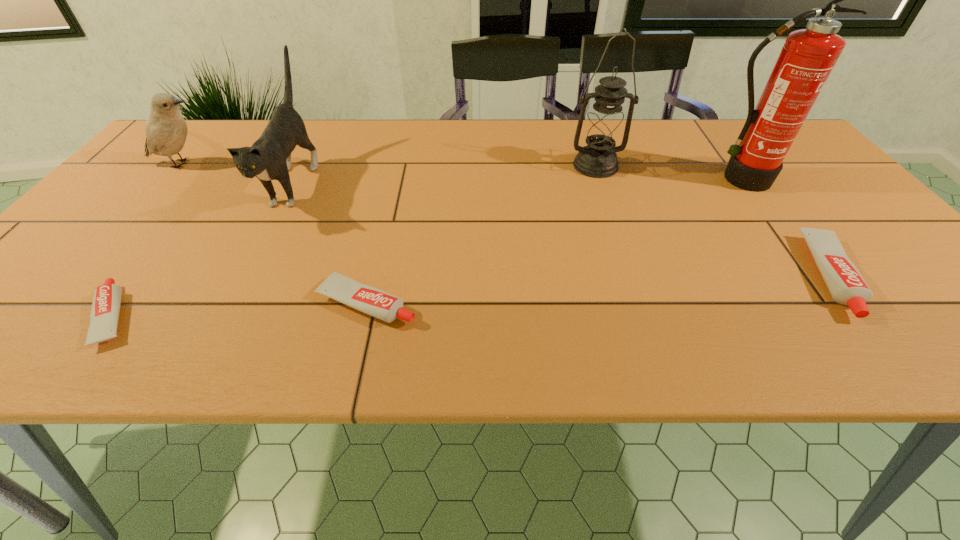
Find the location of a particular element. free region at the right edge is located at coordinates (879, 243).

Where is `vacant space at the far left corner`? vacant space at the far left corner is located at coordinates (216, 132).

Where is `vacant area between the fifth shortest object and the shortest toothpaste`? The height and width of the screenshot is (540, 960). vacant area between the fifth shortest object and the shortest toothpaste is located at coordinates (204, 249).

You are a GUI agent. You are given a task and a screenshot of the screen. Output one action in this format:
    pyautogui.click(x=<x>, y=<y>)
    Task: Click on the free space between the shortest toothpaste and the third shortest object
    The height and width of the screenshot is (540, 960).
    Given the screenshot: What is the action you would take?
    pyautogui.click(x=473, y=296)

At what (x,y) coordinates should I click in order to perform the action: click on vacant point located between the fire extinguisher and the fourth object from right to left. Please return your answer as a coordinate pair (x, y). Looking at the image, I should click on (553, 241).

Find the location of a particular element. free space between the cat and the fourth object from right to left is located at coordinates (331, 242).

I want to click on vacant area that lies between the bird and the rightmost toothpaste, so click(508, 220).

Where is `free space between the sixth tallest object and the cat`? free space between the sixth tallest object and the cat is located at coordinates (331, 242).

Locate an element on the screen. This screenshot has width=960, height=540. free spot between the third tallest object and the bird is located at coordinates (238, 173).

Image resolution: width=960 pixels, height=540 pixels. I want to click on empty location between the fifth object from left to right and the fifth tallest object, so click(x=714, y=221).